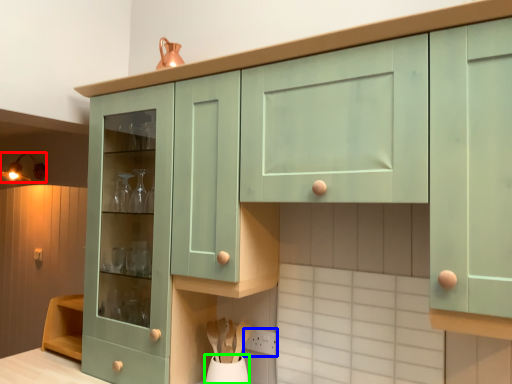
Question: Which is farther away from light fixture (highlighted by a red box)? power plugs and sockets (highlighted by a blue box) or vase (highlighted by a green box)?

Choices:
 (A) power plugs and sockets
 (B) vase

Answer: (A)